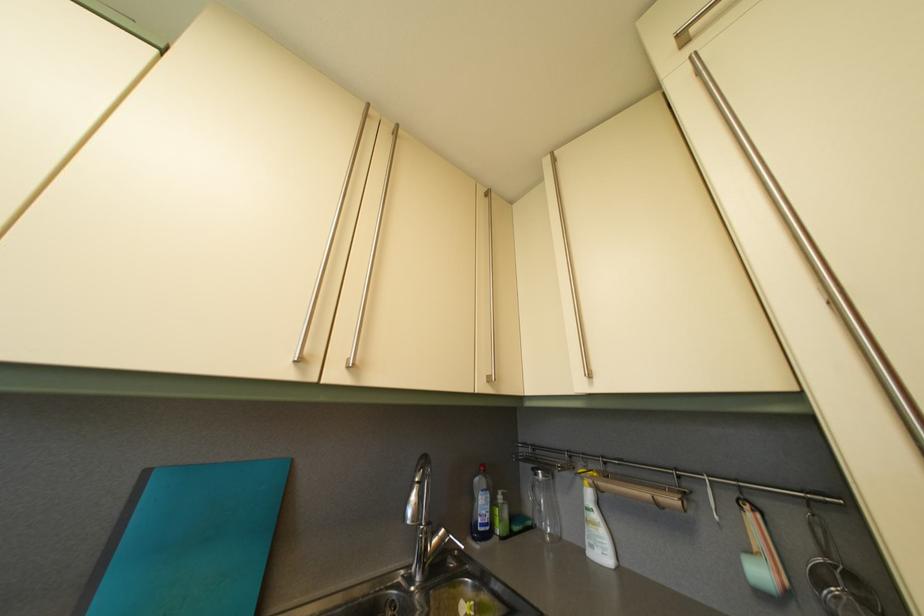
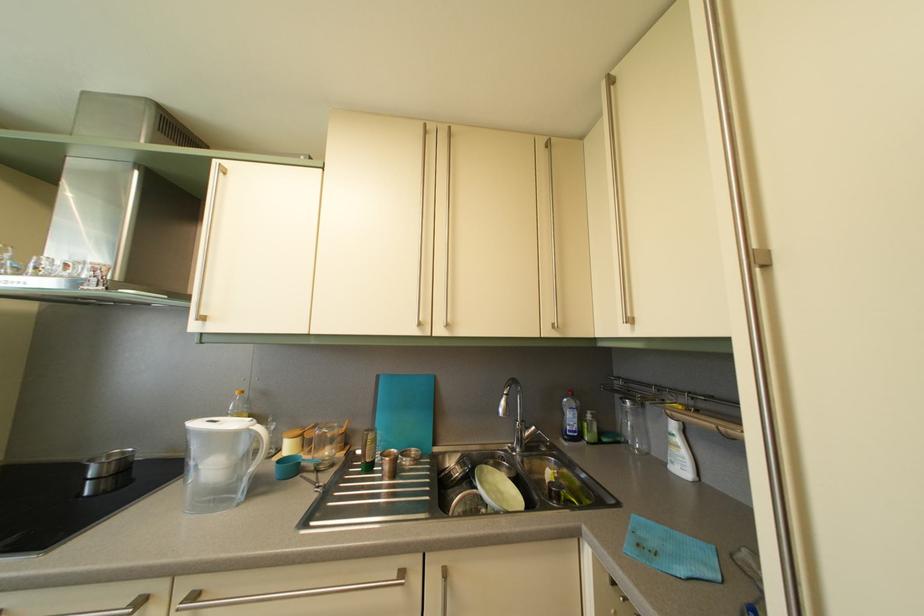
Find the pixel in the second image that matches (x=490, y=533) in the first image.

(578, 439)